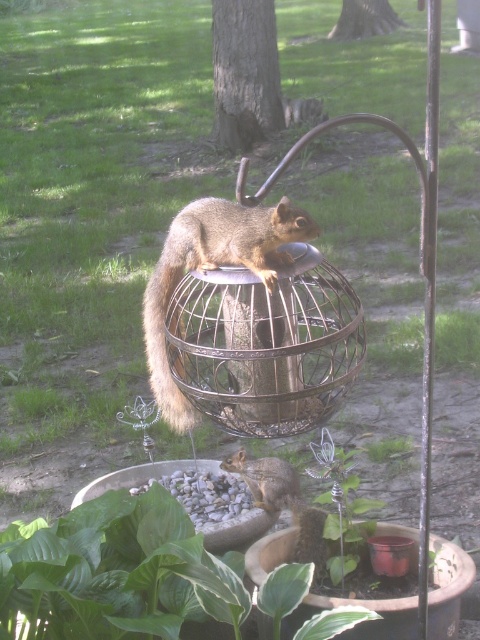
What are the coordinates of `brown furry squirrel at center` in the screenshot? It's located at (213, 268).

Does point (274, 237) come in front of point (256, 26)?

Yes, point (274, 237) is closer to viewer.

Locate an element on the screen. This screenshot has width=480, height=640. brown furry squirrel at center is located at coordinates (213, 268).

Is point (168, 268) farther from viewer compared to point (148, 332)?

No, (168, 268) is in front of (148, 332).

Identify the location of brown furry squirrel at center. (213, 268).

Is point (232, 76) less distant than point (254, 481)?

No, it is not.

At what (x,y) coordinates should I click in order to perform the action: click on brown rough bark tree at upper center. Please return your answer as a coordinate pair (x, y). Looking at the image, I should click on pyautogui.click(x=244, y=74).

This screenshot has height=640, width=480. I want to click on brown rough bark tree at upper center, so click(244, 74).